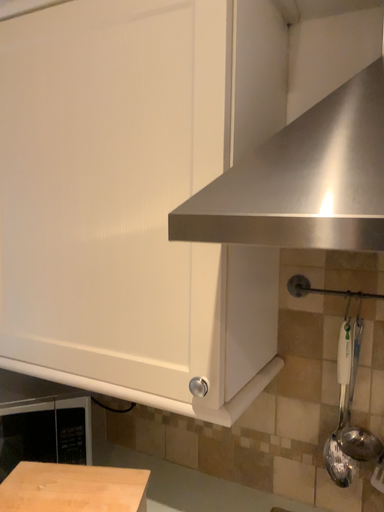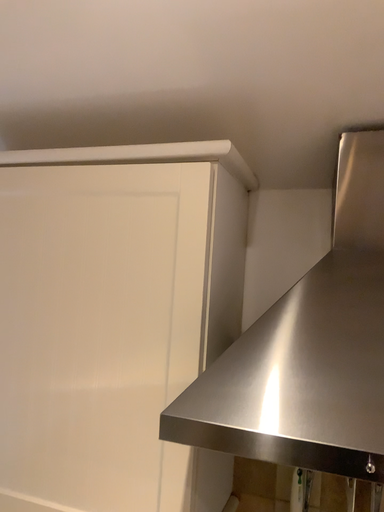
Question: How did the camera likely rotate when shooting the video?

Choices:
 (A) rotated right
 (B) rotated left

Answer: (A)